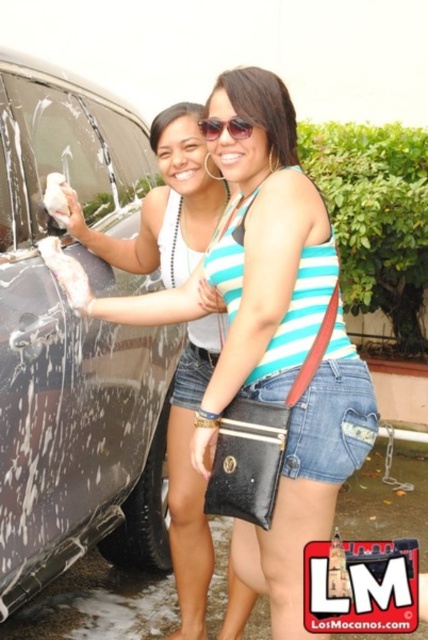
Can you confirm if shiny metallic car at left is bigger than blue striped tank top at center?

Indeed, shiny metallic car at left has a larger size compared to blue striped tank top at center.

Is point (30, 292) farther from viewer compared to point (282, 372)?

Yes, it is behind point (282, 372).

At what (x,y) coordinates should I click in order to perform the action: click on shiny metallic car at left. Please return your answer as a coordinate pair (x, y). This screenshot has height=640, width=428. Looking at the image, I should click on (74, 346).

Who is taller, shiny metallic car at left or sunglasses at upper center?

shiny metallic car at left

Is shiny metallic car at left bigger than sunglasses at upper center?

Yes, shiny metallic car at left is bigger than sunglasses at upper center.

Which is in front, point (149, 376) or point (216, 134)?

Positioned in front is point (216, 134).

In order to click on shiny metallic car at left in this screenshot , I will do `click(74, 346)`.

From the picture: Can you confirm if blue striped tank top at center is thinner than sunglasses at upper center?

No.

Where is `blue striped tank top at center`? blue striped tank top at center is located at coordinates (244, 260).

Does point (285, 547) come behind point (211, 125)?

No, it is in front of (211, 125).

Identify the location of blue striped tank top at center. (244, 260).